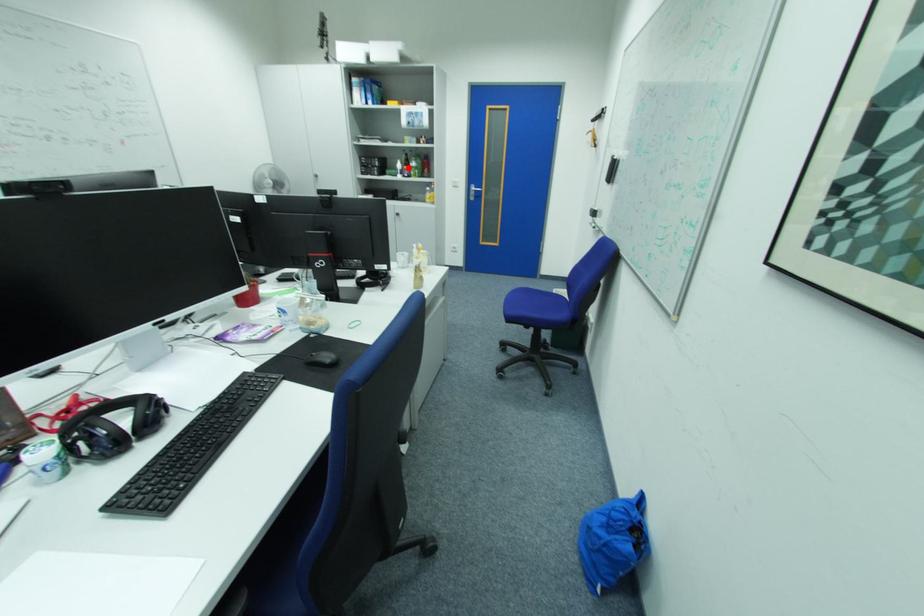
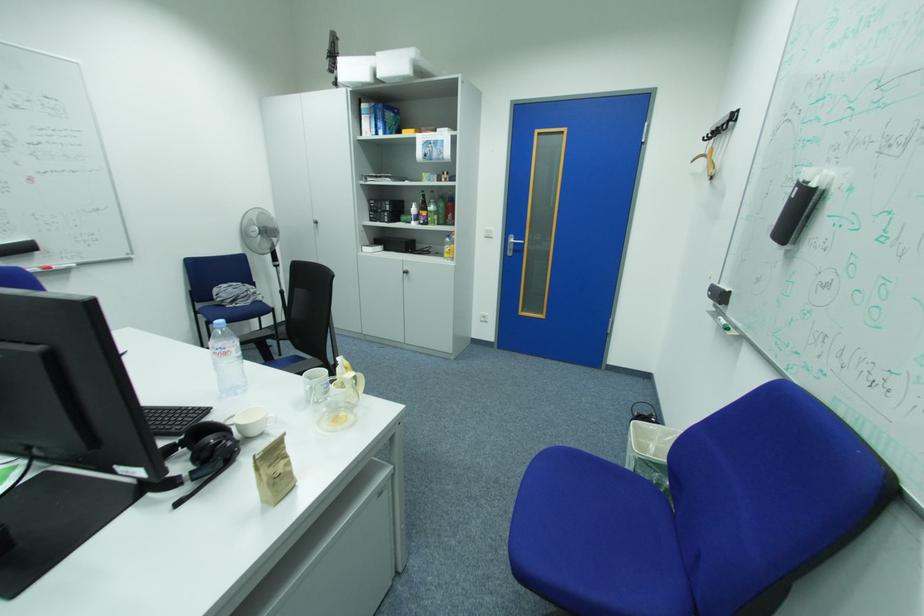
Question: I am providing you with two images of the same scene from different viewpoints. A red point is marked on the first image. At the location where the point appears in image 1, is it still visible in image 2?

Choices:
 (A) Yes
 (B) No

Answer: (A)